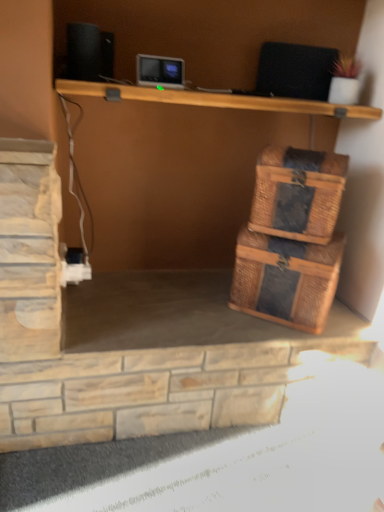
The image size is (384, 512). What do you see at coordinates (286, 279) in the screenshot?
I see `rattan woven storage box at lower right` at bounding box center [286, 279].

This screenshot has width=384, height=512. I want to click on rattan basket at right, so click(298, 193).

This screenshot has height=512, width=384. What do you see at coordinates (298, 193) in the screenshot?
I see `rattan basket at right` at bounding box center [298, 193].

What are the coordinates of `rattan woven storage box at lower right` in the screenshot? It's located at (286, 279).

Consider the image. Is rattan woven storage box at lower right far away from black matte speaker at upper left?

They are positioned close to each other.

Is rattan woven storage box at lower right surrounding black matte speaker at upper left?

Definitely not — black matte speaker at upper left is not inside rattan woven storage box at lower right.

From the image's perspective, is rattan woven storage box at lower right above or below black matte speaker at upper left?

rattan woven storage box at lower right is situated lower than black matte speaker at upper left in the image.

Is rattan woven storage box at lower right further to the viewer compared to black matte speaker at upper left?

Yes, it is behind black matte speaker at upper left.

Can you confirm if rattan woven storage box at lower right is shorter than rattan basket at right?

In fact, rattan woven storage box at lower right may be taller than rattan basket at right.

Are rattan woven storage box at lower right and rattan basket at right far apart?

rattan woven storage box at lower right is actually quite close to rattan basket at right.

Is rattan woven storage box at lower right oriented towards rattan basket at right?

No.

Between rattan woven storage box at lower right and rattan basket at right, which one has larger width?

rattan woven storage box at lower right.

Can you confirm if rattan basket at right is wider than rattan woven storage box at lower right?

No, rattan basket at right is not wider than rattan woven storage box at lower right.

How far apart are rattan basket at right and rattan woven storage box at lower right?

rattan basket at right and rattan woven storage box at lower right are 13.92 centimeters apart from each other.

Is rattan woven storage box at lower right completely or partially inside rattan basket at right?

That's incorrect, rattan woven storage box at lower right is not inside rattan basket at right.

Between point (258, 166) and point (252, 258), which one is positioned behind?

The point (252, 258) is behind.

From the picture: Considering the sizes of objects rattan basket at right and black matte speaker at upper left in the image provided, who is bigger, rattan basket at right or black matte speaker at upper left?

rattan basket at right.

Does point (271, 148) lie behind point (101, 34)?

Yes, it is.

Based on the photo, which object is positioned more to the right, rattan basket at right or black matte speaker at upper left?

rattan basket at right.

Is black matte speaker at upper left outside of rattan woven storage box at lower right?

Absolutely, black matte speaker at upper left is external to rattan woven storage box at lower right.

From the image's perspective, is black matte speaker at upper left located above or below rattan woven storage box at lower right?

Clearly, from the image's perspective, black matte speaker at upper left is above rattan woven storage box at lower right.

Who is more distant, black matte speaker at upper left or rattan woven storage box at lower right?

rattan woven storage box at lower right is behind.

How different are the orientations of black matte speaker at upper left and rattan woven storage box at lower right in degrees?

The angular difference between black matte speaker at upper left and rattan woven storage box at lower right is 41.5 degrees.

How distant is black matte speaker at upper left from rattan basket at right?

They are 26.35 inches apart.

Is there a large distance between black matte speaker at upper left and rattan basket at right?

No, black matte speaker at upper left is in close proximity to rattan basket at right.

Does point (79, 58) appear closer or farther from the camera than point (289, 193)?

Point (79, 58) appears to be closer to the viewer than point (289, 193).

From the image's perspective, which is below, black matte speaker at upper left or rattan basket at right?

rattan basket at right.

Identify the location of speaker that appears on the left of rattan woven storage box at lower right. (89, 52).

This screenshot has height=512, width=384. In order to click on storage box that is behind the rattan basket at right in this screenshot , I will do `click(286, 279)`.

Which object lies nearer to the anchor point rattan basket at right, rattan woven storage box at lower right or black matte speaker at upper left?

rattan woven storage box at lower right is positioned closer to the anchor rattan basket at right.

From the image, which object appears to be farther from rattan basket at right, black matte speaker at upper left or rattan woven storage box at lower right?

Based on the image, black matte speaker at upper left appears to be further to rattan basket at right.

Looking at the image, which one is located further to rattan woven storage box at lower right, rattan basket at right or black matte speaker at upper left?

black matte speaker at upper left is positioned further to the anchor rattan woven storage box at lower right.

When comparing their distances from black matte speaker at upper left, does rattan woven storage box at lower right or rattan basket at right seem closer?

rattan basket at right is positioned closer to the anchor black matte speaker at upper left.

When comparing their distances from black matte speaker at upper left, does rattan basket at right or rattan woven storage box at lower right seem closer?

Among the two, rattan basket at right is located nearer to black matte speaker at upper left.

From the image, which object appears to be farther from rattan woven storage box at lower right, black matte speaker at upper left or rattan basket at right?

black matte speaker at upper left lies further to rattan woven storage box at lower right than the other object.

Identify the location of storage box situated between black matte speaker at upper left and rattan basket at right from left to right. The image size is (384, 512). pos(286,279).